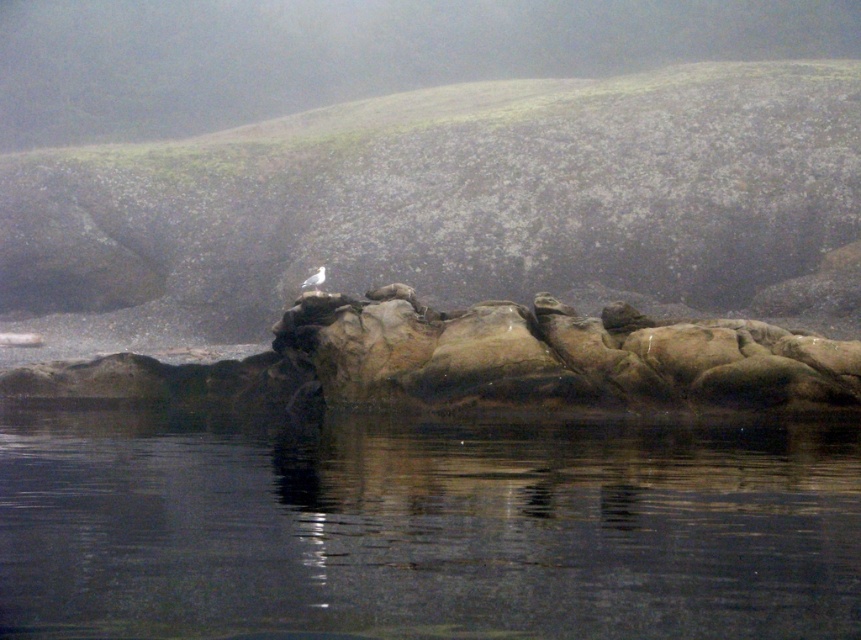
Question: Can you confirm if transparent water at center is positioned above white matte bird at center?

Choices:
 (A) no
 (B) yes

Answer: (A)

Question: Among these points, which one is farthest from the camera?

Choices:
 (A) (318, 282)
 (B) (265, 465)

Answer: (A)

Question: Which point is farther to the camera?

Choices:
 (A) transparent water at center
 (B) white matte bird at center

Answer: (B)

Question: Which point is closer to the camera?

Choices:
 (A) (194, 605)
 (B) (311, 280)

Answer: (A)

Question: Does transparent water at center lie behind white matte bird at center?

Choices:
 (A) yes
 (B) no

Answer: (B)

Question: Is transparent water at center positioned before white matte bird at center?

Choices:
 (A) no
 (B) yes

Answer: (B)